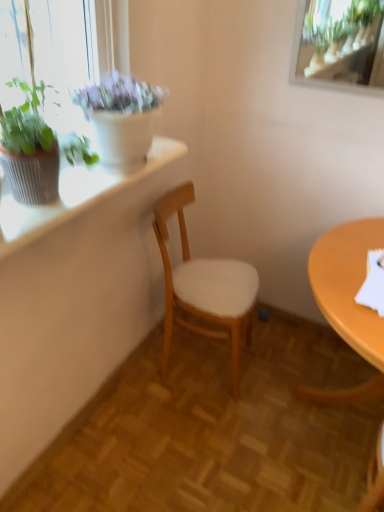
Question: In terms of width, does matte white pot at upper left, the 2th houseplant in the front-to-back sequence, look wider or thinner when compared to green leafy plant at upper left, which is counted as the 2th houseplant, starting from the back?

Choices:
 (A) thin
 (B) wide

Answer: (B)

Question: Looking at the image, does matte white pot at upper left, the 1th houseplant in the back-to-front sequence, seem bigger or smaller compared to green leafy plant at upper left, placed as the 1th houseplant when sorted from front to back?

Choices:
 (A) small
 (B) big

Answer: (B)

Question: Which object is positioned closest to the matte white pot at upper left, the 2th houseplant in the front-to-back sequence?

Choices:
 (A) white woven wood chair at center
 (B) green leafy plant at upper left, which is counted as the 2th houseplant, starting from the back
 (C) textured white window sill at upper left

Answer: (C)

Question: Which object is positioned farthest from the textured white window sill at upper left?

Choices:
 (A) green leafy plant at upper left, placed as the 1th houseplant when sorted from front to back
 (B) matte white pot at upper left, the 1th houseplant in the back-to-front sequence
 (C) white woven wood chair at center

Answer: (C)